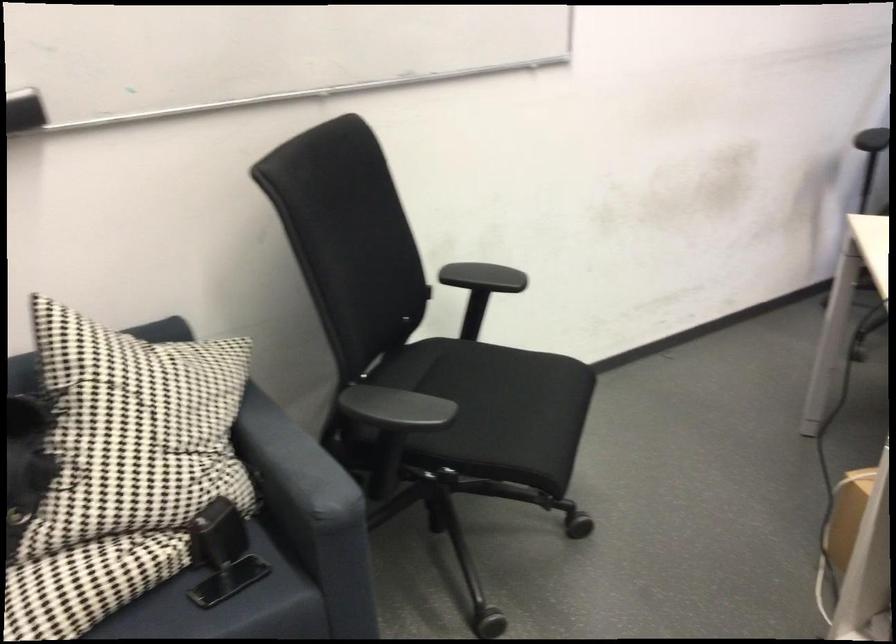
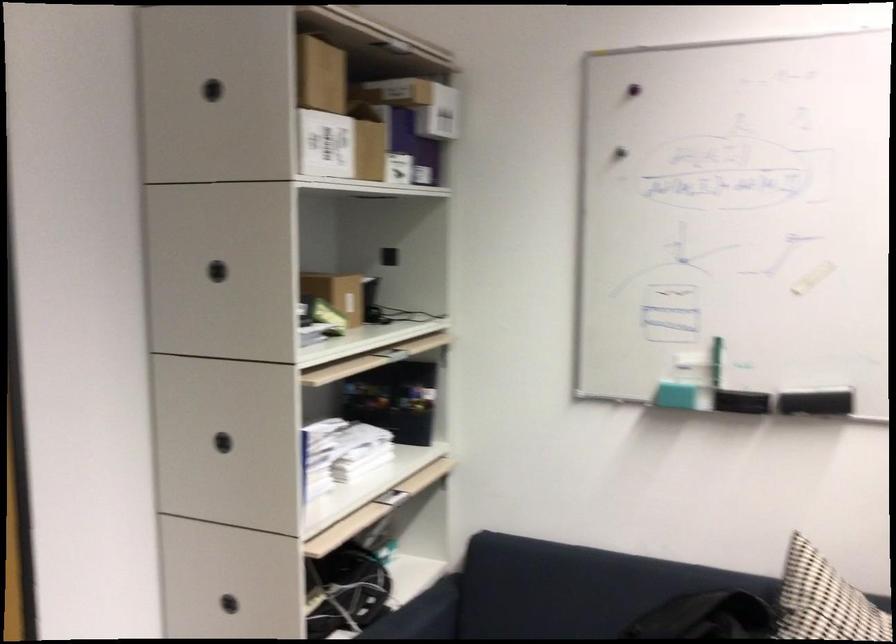
The point at [88,363] is marked in the first image. Where is the corresponding point in the second image?

(823, 601)